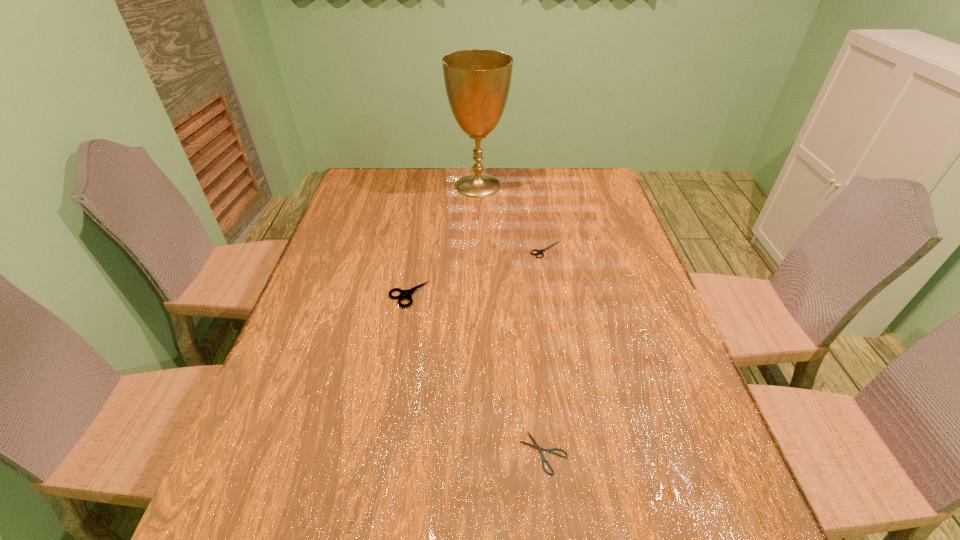
Find the location of `unoccupied area between the third farthest object and the shortest object`. unoccupied area between the third farthest object and the shortest object is located at coordinates (476, 374).

You are a GUI agent. You are given a task and a screenshot of the screen. Output one action in this format:
    pyautogui.click(x=<x>, y=<y>)
    Task: Click on the vacant area between the tallest object and the shortest object
    This screenshot has height=540, width=960.
    Given the screenshot: What is the action you would take?
    pyautogui.click(x=511, y=319)

This screenshot has height=540, width=960. Identify the location of empty space that is in between the trophy cup and the third nearest object. (512, 218).

Locate an element on the screen. vacant point located between the farthest object and the farthest shears is located at coordinates (512, 218).

The height and width of the screenshot is (540, 960). I want to click on vacant space that is in between the nearest object and the third nearest object, so click(x=545, y=351).

This screenshot has width=960, height=540. I want to click on empty space between the farthest shears and the third shortest object, so click(x=478, y=272).

What are the coordinates of `empty space between the shortest shears and the second farthest object` in the screenshot? It's located at (545, 351).

Locate an element on the screen. free spot between the tallest object and the shortest shears is located at coordinates (511, 319).

Choose which object is the second nearest neighbor to the farthest object. Please provide its 2D coordinates. Your answer should be formatted as a tuple, i.e. [(x, y)], where the tuple contains the x and y coordinates of a point satisfying the conditions above.

[(404, 294)]

Locate an element on the screen. The image size is (960, 540). object that is the second closest to the shortest object is located at coordinates (539, 252).